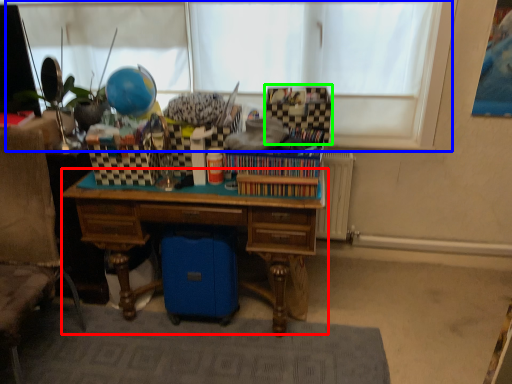
Question: Estimate the real-world distances between objects in this image. Which object is closer to desk (highlighted by a red box), window screen (highlighted by a blue box) or storage box (highlighted by a green box)?

Choices:
 (A) window screen
 (B) storage box

Answer: (B)